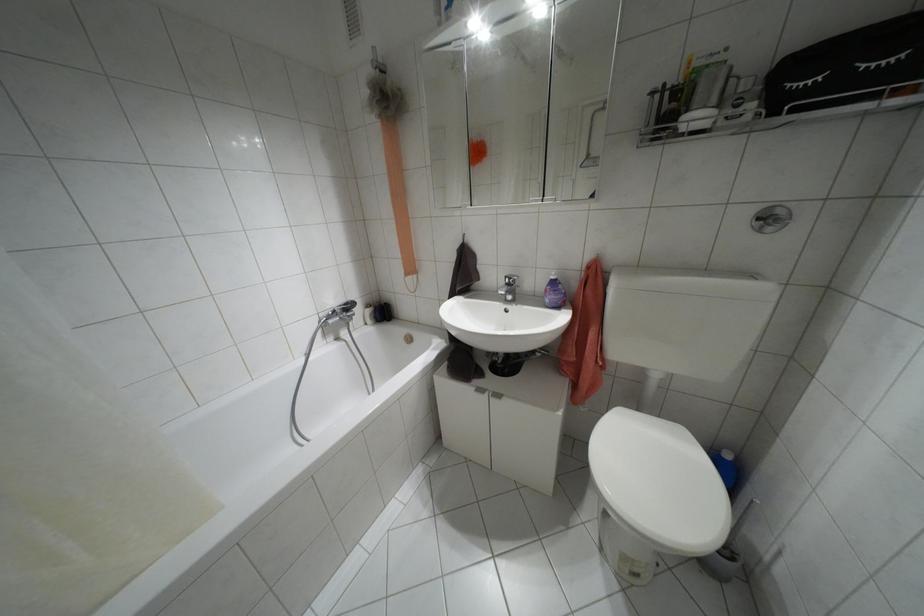
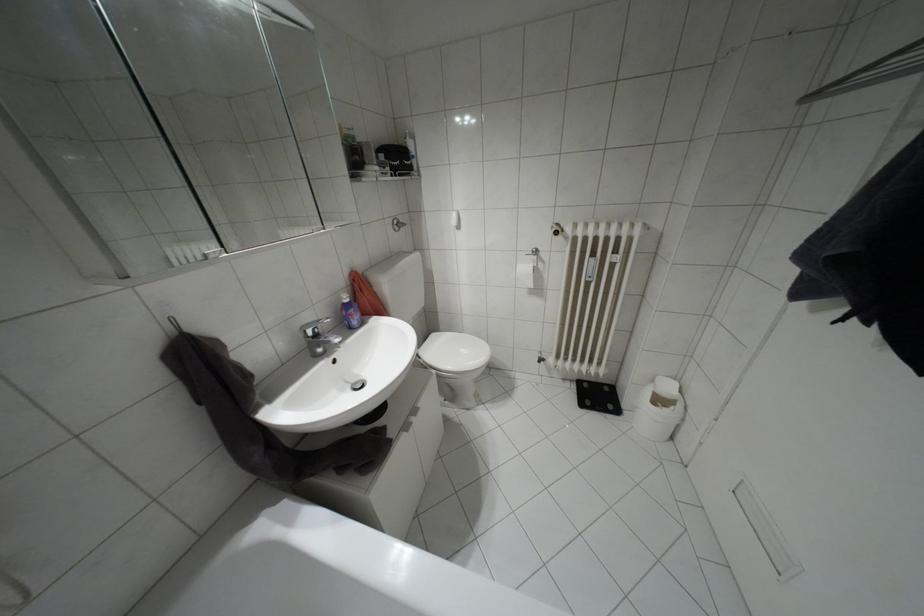
In the second image, find the point that corresponds to (552,277) in the first image.

(346, 300)